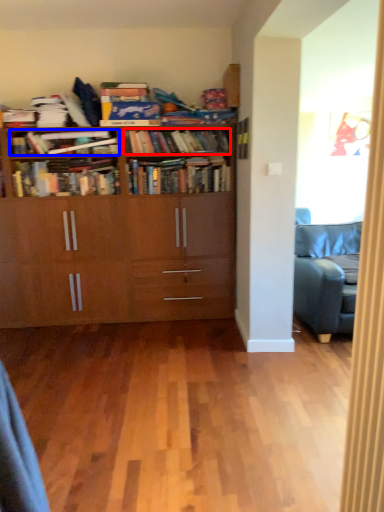
Question: Among these objects, which one is nearest to the camera, book (highlighted by a red box) or book (highlighted by a blue box)?

Choices:
 (A) book
 (B) book

Answer: (B)